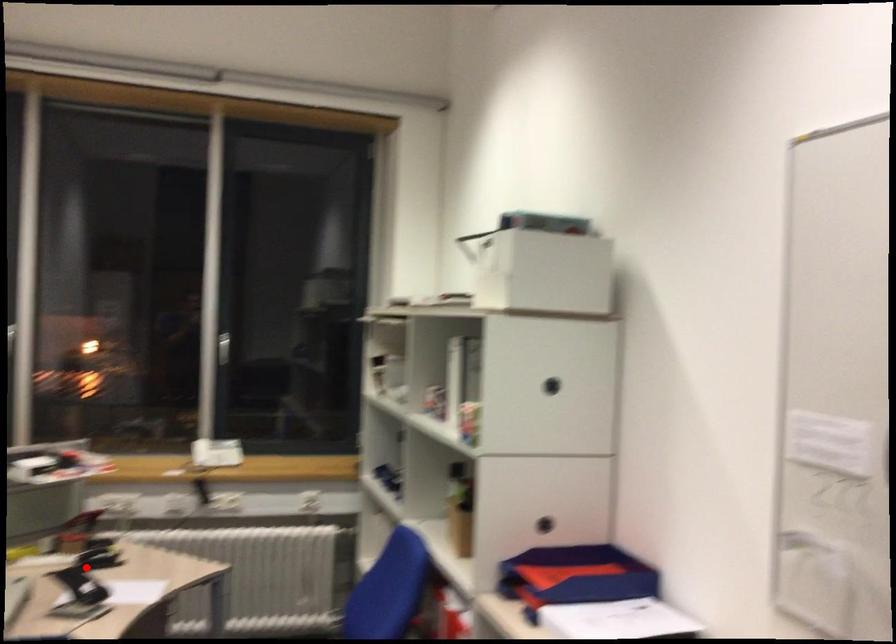
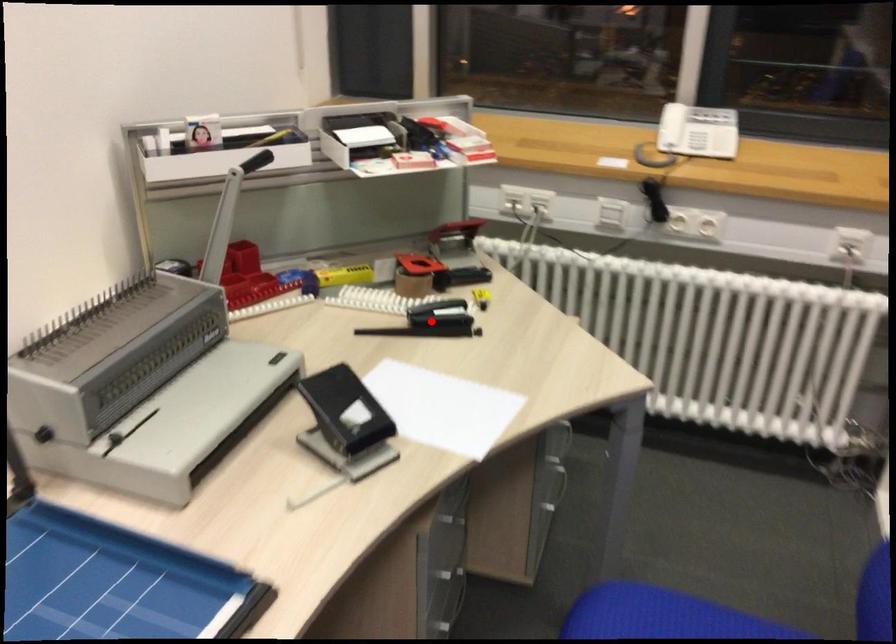
I am providing you with two images of the same scene from different viewpoints. A red point is marked on the first image and another point is marked on the second image. Are the points marked in image1 and image2 representing the same 3D position?

Yes